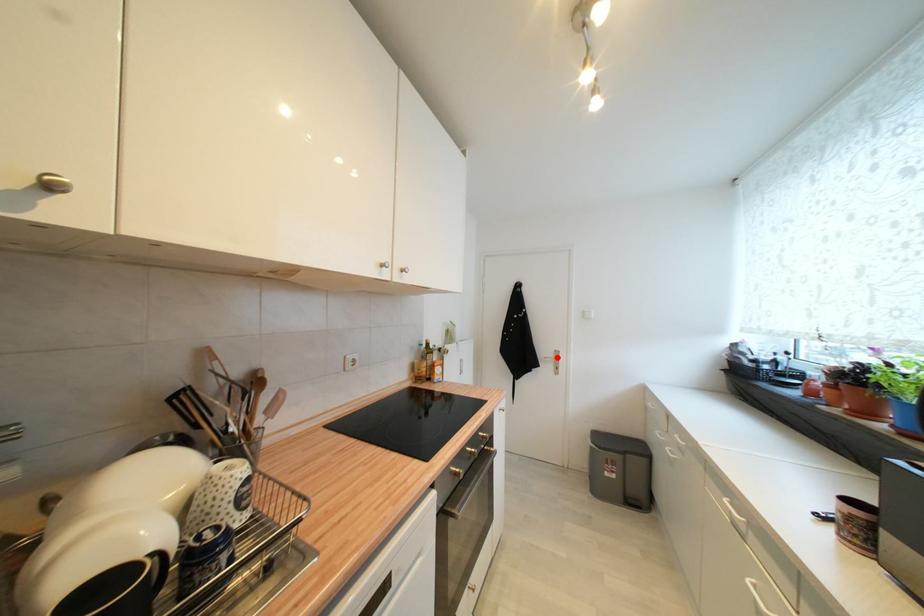
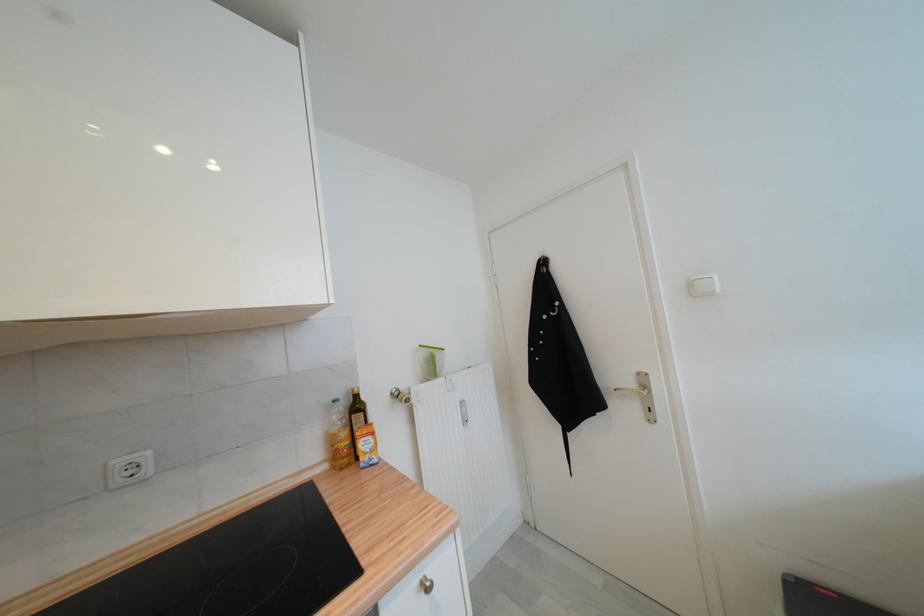
In the second image, find the point that corresponds to the highlighted location in the first image.

(637, 386)